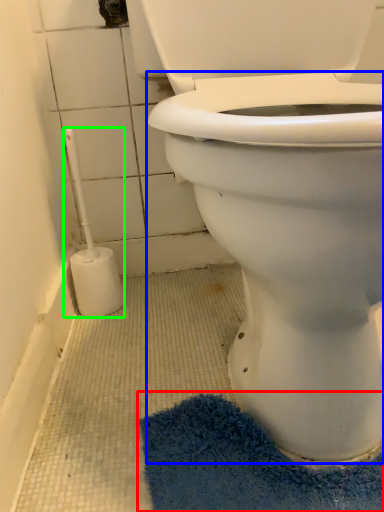
Question: Which object is the farthest from bath mat (highlighted by a red box)? Choose among these: bidet (highlighted by a blue box) or brush (highlighted by a green box).

Choices:
 (A) bidet
 (B) brush

Answer: (B)